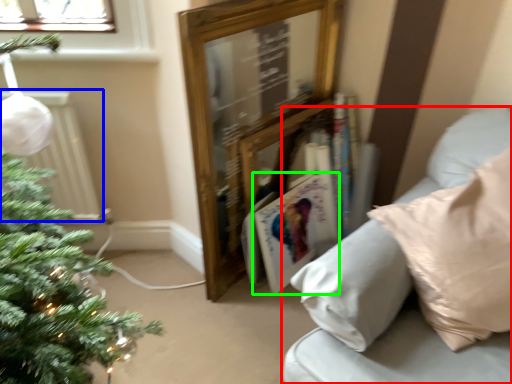
Question: Estimate the real-world distances between objects in this image. Which object is closer to studio couch (highlighted by a red box), radiator (highlighted by a blue box) or magazine (highlighted by a green box)?

Choices:
 (A) radiator
 (B) magazine

Answer: (B)